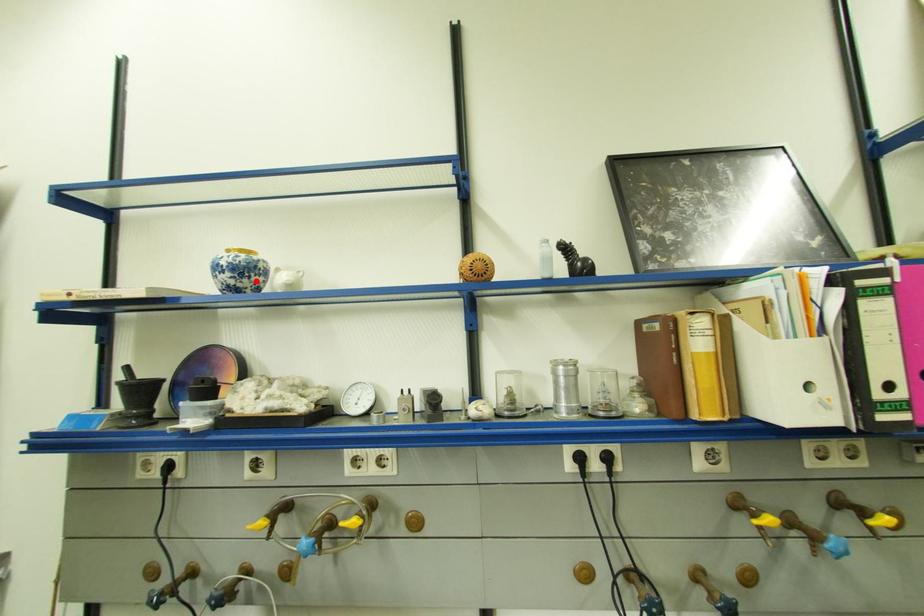
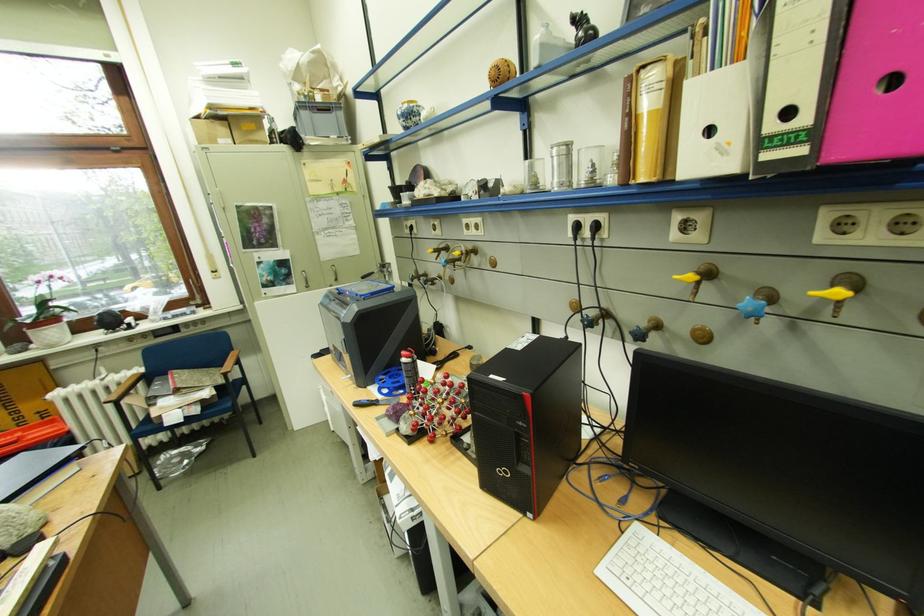
Where in the second image is the point corresponding to the highlighted location from the first image?

(419, 122)